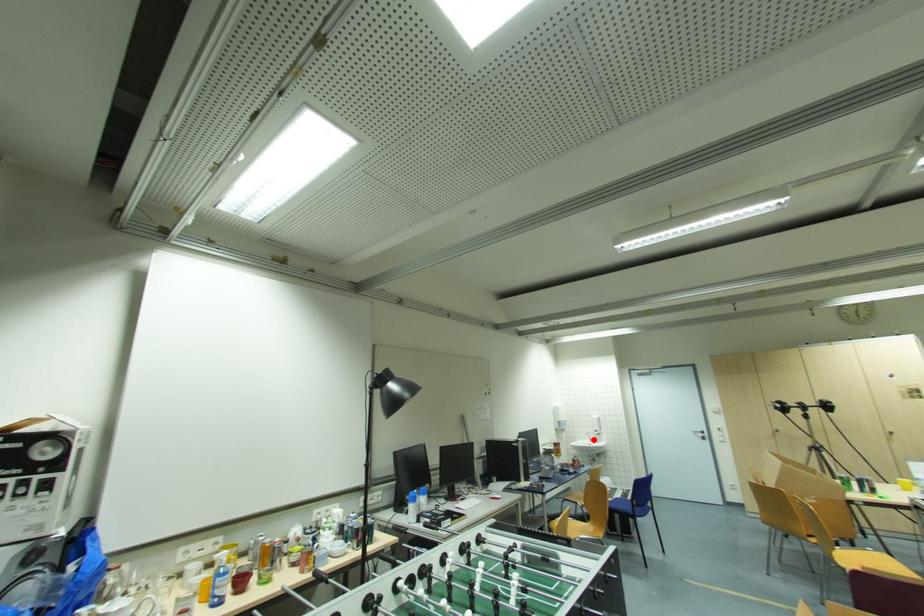
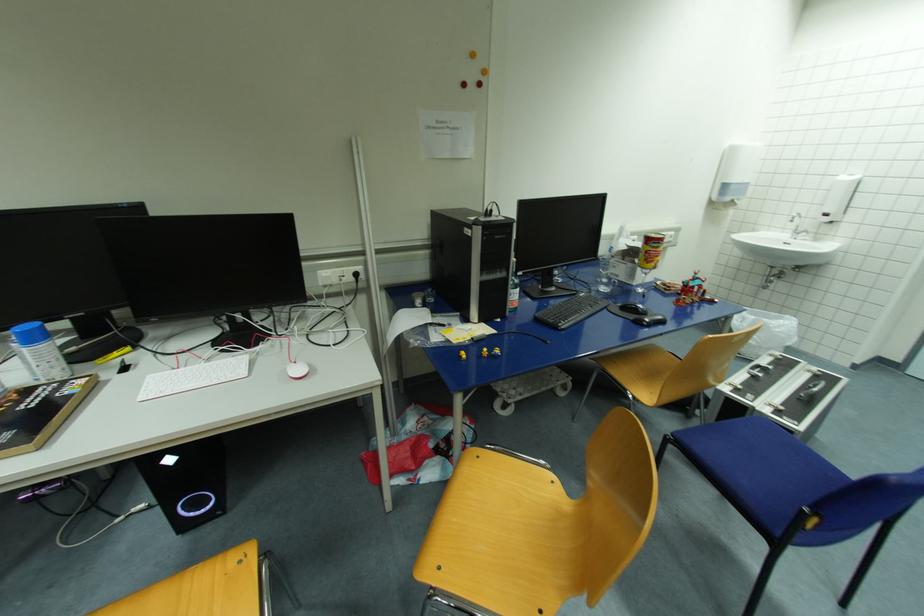
Where in the second image is the point corresponding to the highlighted location from the first image?

(799, 233)